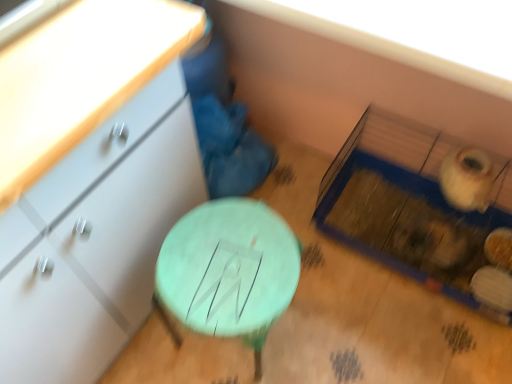
Question: From their relative heights in the image, would you say green painted wood stool at center is taller or shorter than matte white chest of drawers at left?

Choices:
 (A) tall
 (B) short

Answer: (B)

Question: Looking at their shapes, would you say green painted wood stool at center is wider or thinner than matte white chest of drawers at left?

Choices:
 (A) thin
 (B) wide

Answer: (A)

Question: Which is correct: green painted wood stool at center is inside matte white chest of drawers at left, or outside of it?

Choices:
 (A) inside
 (B) outside

Answer: (B)

Question: Visually, is matte white chest of drawers at left positioned to the left or to the right of green painted wood stool at center?

Choices:
 (A) right
 (B) left

Answer: (B)

Question: Is point (93, 147) closer or farther from the camera than point (231, 274)?

Choices:
 (A) farther
 (B) closer

Answer: (B)

Question: Which is correct: matte white chest of drawers at left is inside green painted wood stool at center, or outside of it?

Choices:
 (A) inside
 (B) outside

Answer: (B)

Question: Is matte white chest of drawers at left bigger or smaller than green painted wood stool at center?

Choices:
 (A) small
 (B) big

Answer: (B)